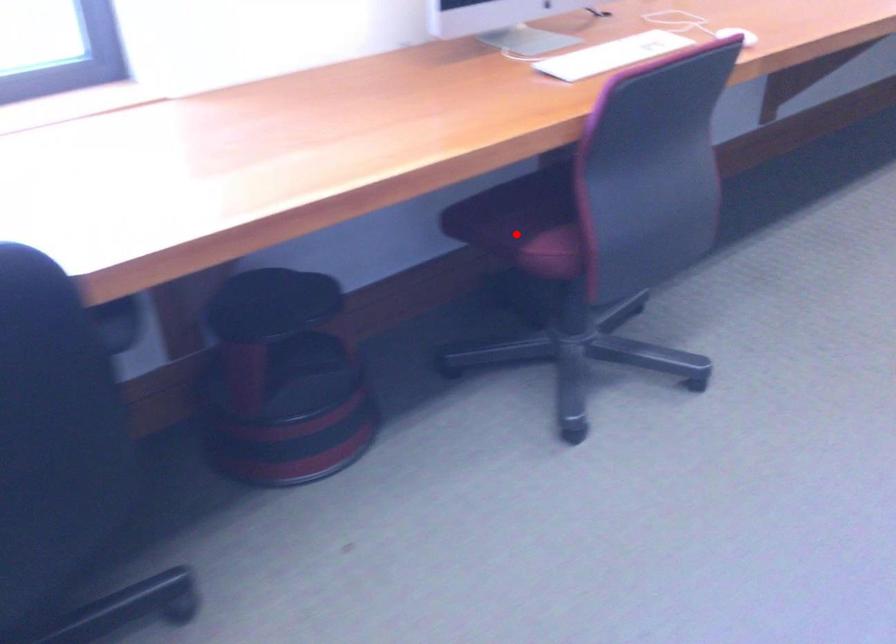
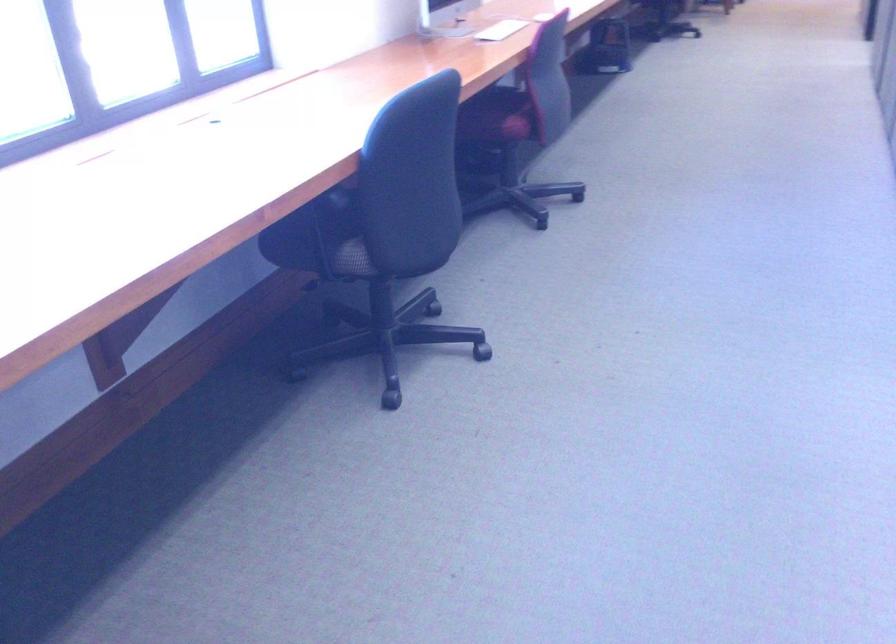
Find the pixel in the second image that matches the highlighted location in the first image.

(497, 116)